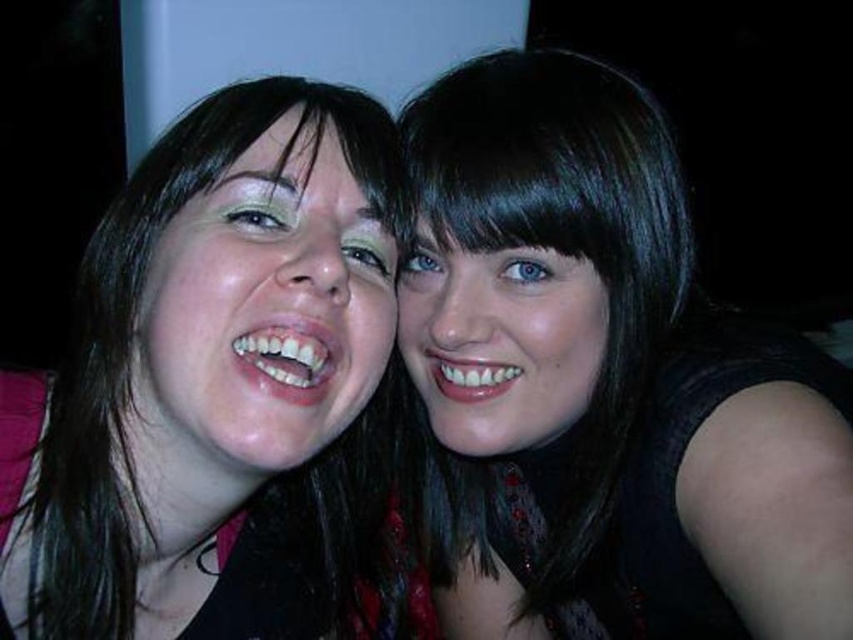
Question: Does matte black hair at left have a larger size compared to smooth skin face at center?

Choices:
 (A) yes
 (B) no

Answer: (A)

Question: Considering the real-world distances, which object is farthest from the matte skin face at left?

Choices:
 (A) smooth skin face at center
 (B) black matte hair at upper right

Answer: (B)

Question: Which point is closer to the camera?

Choices:
 (A) matte black hair at left
 (B) matte skin face at left

Answer: (A)

Question: Considering the relative positions of black matte hair at upper right and matte skin face at left in the image provided, where is black matte hair at upper right located with respect to matte skin face at left?

Choices:
 (A) left
 (B) right

Answer: (B)

Question: Where is matte skin face at left located in relation to smooth skin face at center in the image?

Choices:
 (A) below
 (B) above

Answer: (B)

Question: Among these objects, which one is nearest to the camera?

Choices:
 (A) matte black hair at left
 (B) black matte hair at upper right

Answer: (A)